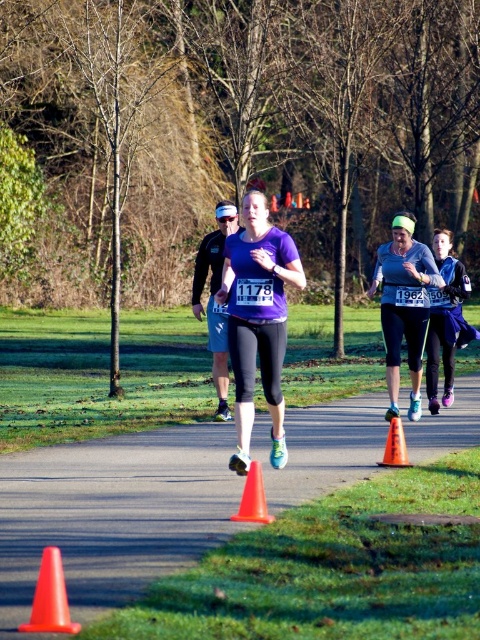
Question: Is orange plastic cone at lower left bigger than orange plastic cone at center?

Choices:
 (A) no
 (B) yes

Answer: (A)

Question: Which point is closer to the camera?

Choices:
 (A) orange plastic cone at lower left
 (B) smooth asphalt road at center
 (C) orange plastic cone at lower center
 (D) matte purple shirt at center

Answer: (A)

Question: Where is matte black visor at center located in relation to orange plastic cone at lower left in the image?

Choices:
 (A) left
 (B) right

Answer: (B)

Question: Which object appears farthest from the camera in this image?

Choices:
 (A) blue synthetic jacket at center
 (B) orange plastic cone at lower left
 (C) orange plastic cone at center
 (D) purple matte running top at center

Answer: (A)

Question: Is the position of smooth asphalt road at center less distant than that of orange plastic cone at lower center?

Choices:
 (A) yes
 (B) no

Answer: (B)

Question: Which object appears farthest from the camera in this image?

Choices:
 (A) purple matte running top at center
 (B) matte black visor at center
 (C) orange plastic cone at lower left
 (D) smooth asphalt road at center

Answer: (B)